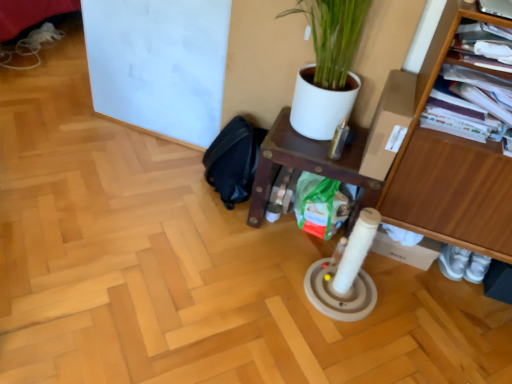
Question: From the image's perspective, is black fabric swivel chair at lower center above or below wooden shelf at center?

Choices:
 (A) above
 (B) below

Answer: (A)

Question: Considering their positions, is black fabric swivel chair at lower center located in front of or behind wooden shelf at center?

Choices:
 (A) behind
 (B) front

Answer: (A)

Question: Which object is the closest to the wooden shelf at center?

Choices:
 (A) wooden shelf at right
 (B) black fabric swivel chair at lower center

Answer: (B)

Question: Estimate the real-world distances between objects in this image. Which object is farther from the wooden shelf at center?

Choices:
 (A) black fabric swivel chair at lower center
 (B) wooden shelf at right

Answer: (B)